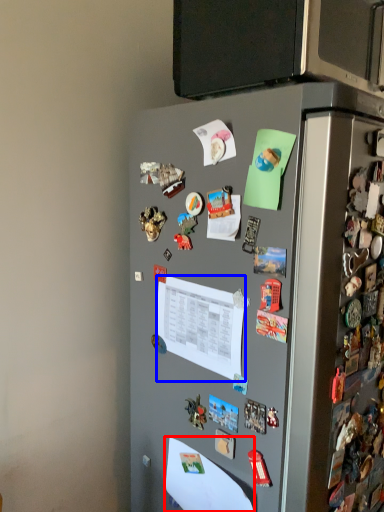
Question: Among these objects, which one is farthest to the camera, paper (highlighted by a red box) or paper (highlighted by a blue box)?

Choices:
 (A) paper
 (B) paper

Answer: (A)